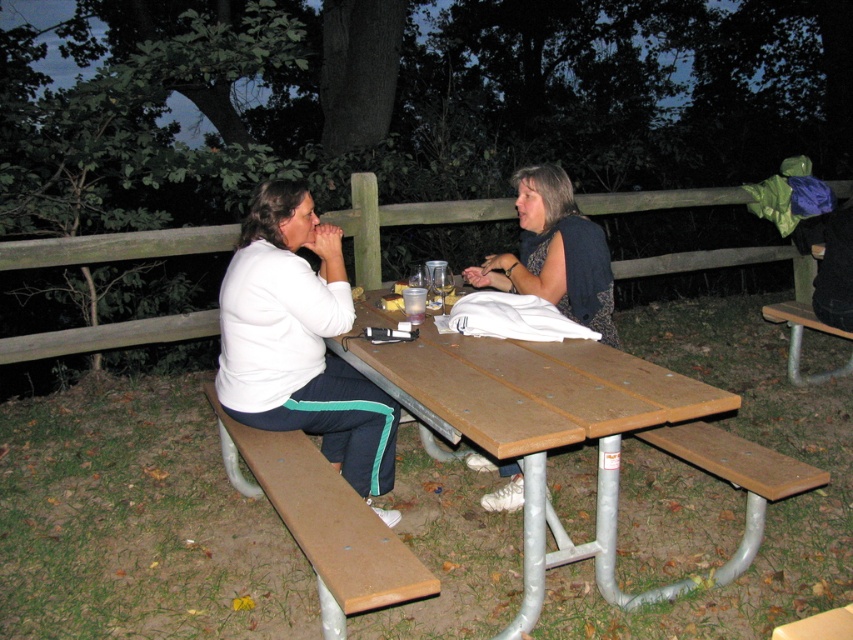
Between white matte pants at left and wooden fence at center, which one has less height?

Standing shorter between the two is wooden fence at center.

Between point (321, 435) and point (357, 253), which one is positioned behind?

The point (357, 253) is more distant.

Which is in front, point (254, 403) or point (720, 188)?

Point (254, 403) is more forward.

Identify the location of white matte pants at left. (300, 342).

Between brown wood picnic table at center and matte black jacket at center, which one has more height?

Standing taller between the two is brown wood picnic table at center.

Is brown wood picnic table at center to the right of matte black jacket at center from the viewer's perspective?

In fact, brown wood picnic table at center is to the left of matte black jacket at center.

Does point (412, 358) lie behind point (518, 202)?

No, (412, 358) is in front of (518, 202).

Where is `brown wood picnic table at center`? This screenshot has height=640, width=853. brown wood picnic table at center is located at coordinates (535, 417).

Can you confirm if white matte shirt at center is thinner than matte black jacket at center?

No, white matte shirt at center is not thinner than matte black jacket at center.

Is white matte shirt at center shorter than matte black jacket at center?

Incorrect, white matte shirt at center's height does not fall short of matte black jacket at center's.

Does point (259, 243) come farther from viewer compared to point (561, 307)?

No.

What are the coordinates of `white matte shirt at center` in the screenshot? It's located at (299, 339).